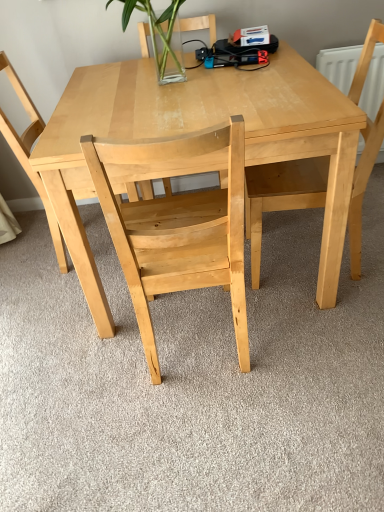
Where is `free spot in front of natural wood chair at center, the 3th chair viewed from the right`? free spot in front of natural wood chair at center, the 3th chair viewed from the right is located at coordinates (57, 319).